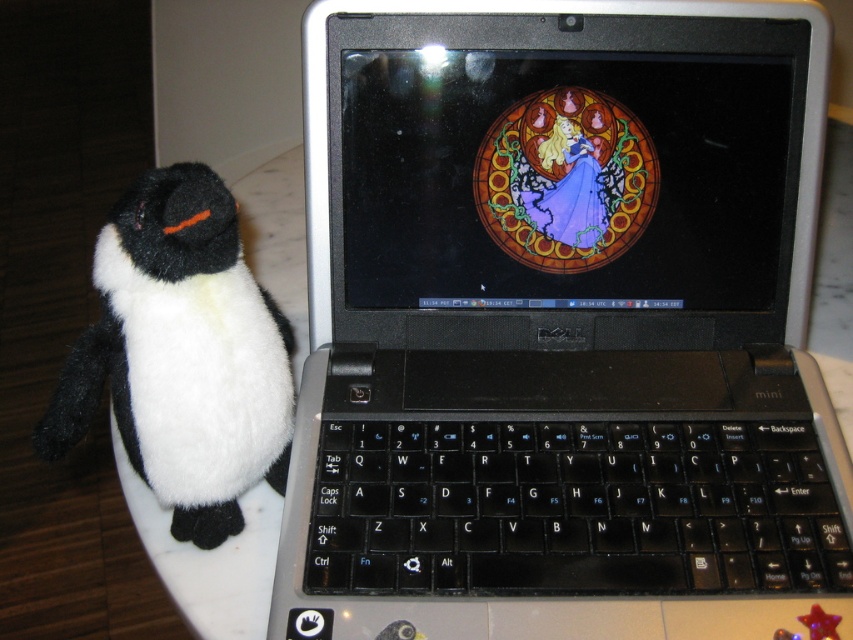
Question: Can you confirm if black plastic laptop at center is positioned to the right of black plastic keyboard at center?

Choices:
 (A) yes
 (B) no

Answer: (B)

Question: Which point is closer to the camera?

Choices:
 (A) black plush penguin at left
 (B) black plastic keyboard at center
 (C) black plastic laptop at center

Answer: (C)

Question: Which point is closer to the camera?

Choices:
 (A) pos(653,570)
 (B) pos(178,508)

Answer: (A)

Question: Does black plastic laptop at center appear over black plush penguin at left?

Choices:
 (A) yes
 (B) no

Answer: (A)

Question: Does black plastic keyboard at center have a lesser width compared to black plush penguin at left?

Choices:
 (A) yes
 (B) no

Answer: (B)

Question: Estimate the real-world distances between objects in this image. Which object is closer to the black plastic laptop at center?

Choices:
 (A) black plastic keyboard at center
 (B) black plush penguin at left

Answer: (A)